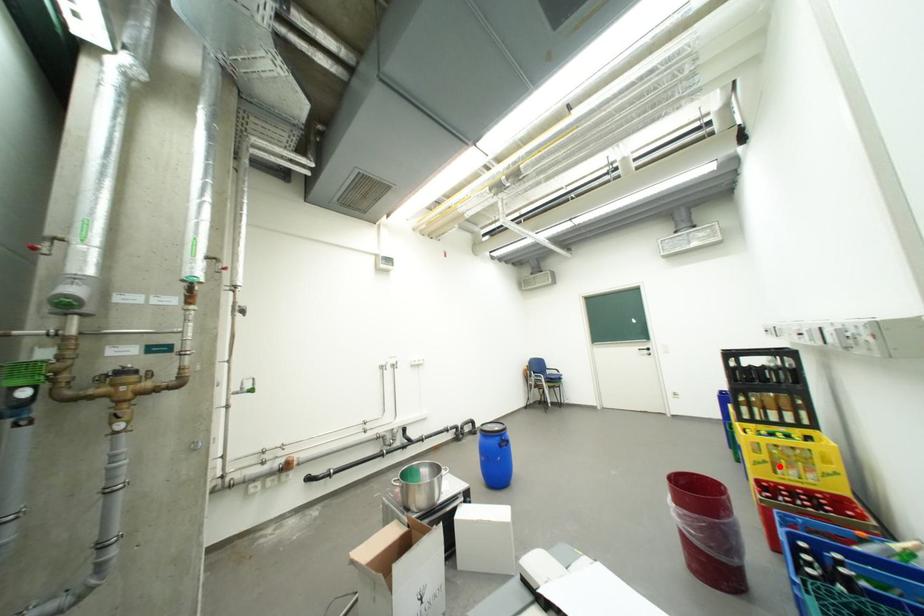
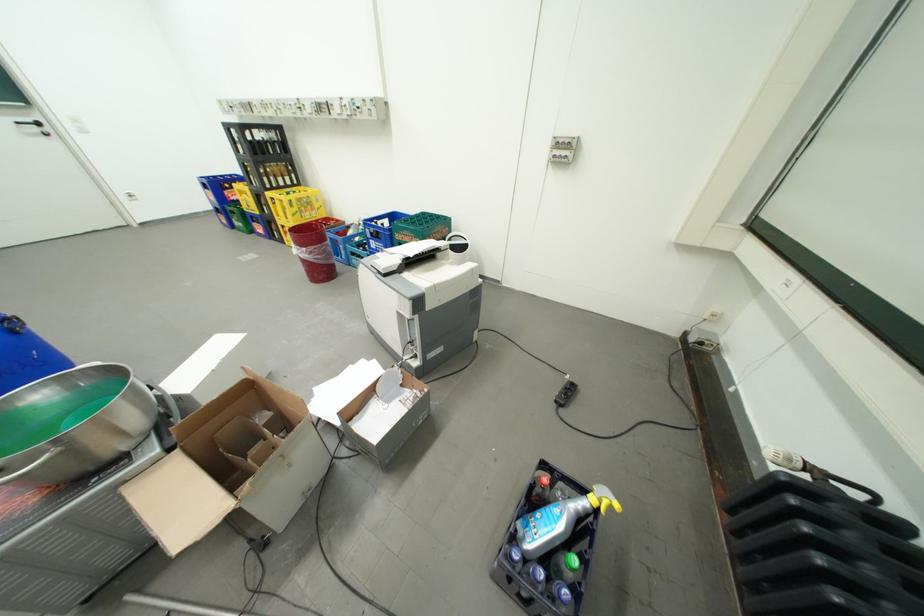
Find the pixel in the second image that matches the highlighted location in the first image.

(310, 215)